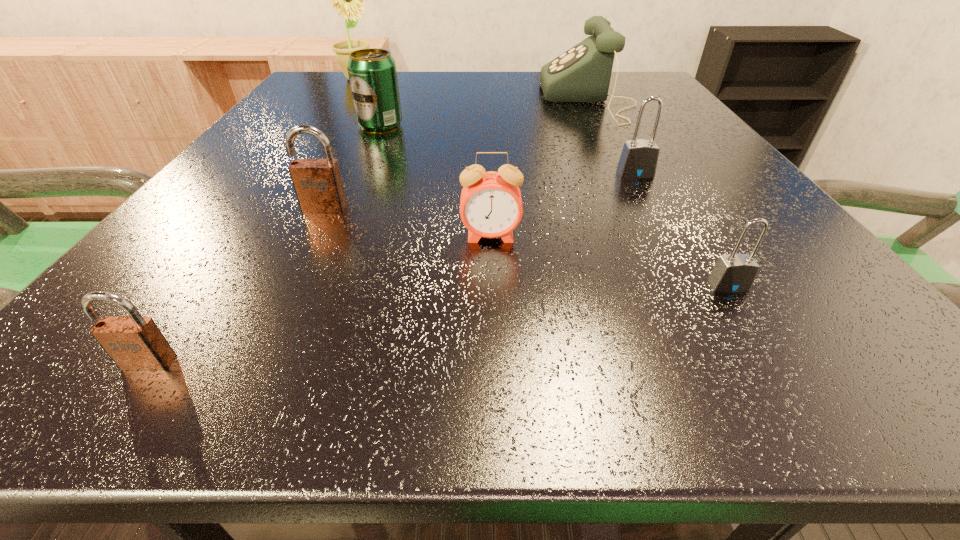
I want to click on free space at the far edge of the desktop, so click(x=451, y=89).

This screenshot has height=540, width=960. What are the coordinates of `free location at the near edge of the desktop` in the screenshot? It's located at (278, 368).

Find the location of a particular element. This screenshot has height=540, width=960. free space at the left edge is located at coordinates (321, 150).

Identify the location of vacant space at the right edge of the desktop. (656, 117).

The image size is (960, 540). In the image, there is a desktop. What are the coordinates of `free space at the far right corner` in the screenshot? It's located at (613, 86).

Find the location of a particular element. This screenshot has width=960, height=540. vacant area that lies between the farthest padlock and the nearer brown padlock is located at coordinates (392, 268).

Locate an element on the screen. Image resolution: width=960 pixels, height=540 pixels. empty space that is in between the yellow sunflower and the pink alarm clock is located at coordinates (423, 158).

The width and height of the screenshot is (960, 540). Identify the location of free point between the bigger brown padlock and the beer can. coord(352,167).

Identify the location of vacant area that lies between the alarm clock and the sunflower. The image size is (960, 540). (423, 158).

What are the coordinates of `free space between the sunflower and the sixth farthest object` in the screenshot? It's located at (423, 158).